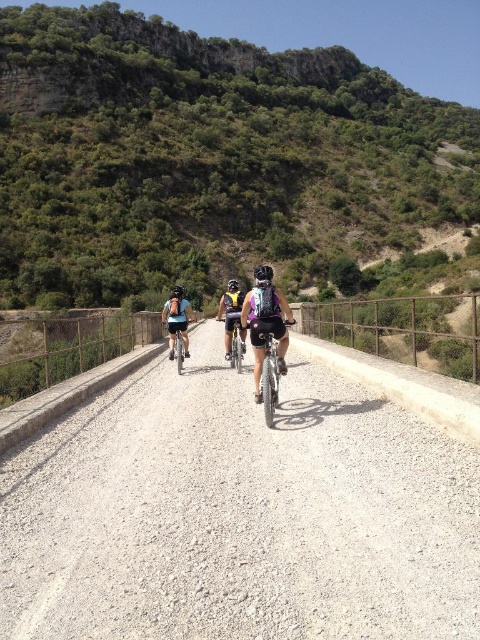
You are planning to install a safety barrier between the gravel road at center and the green leafy hillside at upper center. Given that the distance between them is 561.94 feet, what is the minimum length of the barrier required to span the gap between them?

The minimum length of the barrier required to span the gap between the gravel road at center and the green leafy hillside at upper center should be at least 561.94 feet to cover the entire distance between them.

From the picture: You are a drone operator trying to capture a photo of the cyclists on the gravel road at center. To ensure the road is centered in the photo, where should you position the drone? Use the coordinate system provided in the description to guide your answer.

The gravel road at center is located at coordinate point [239,515], so you should position the drone directly above this point to center the road in the photo.

You are standing on the bridge and want to know the exact position of the metallic silver bicycle at center. Can you determine its coordinates based on the scene?

The metallic silver bicycle at center is located at point coordinates of (267, 371).